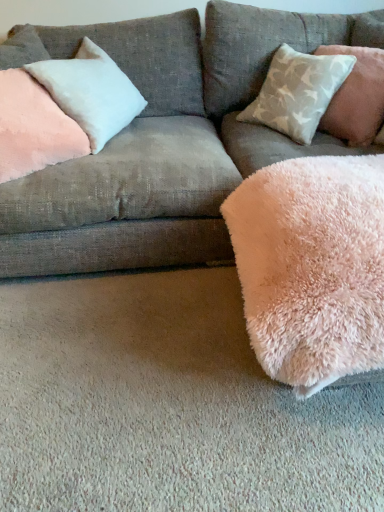
The image size is (384, 512). Describe the element at coordinates (91, 92) in the screenshot. I see `satin white pillow at upper left, arranged as the 2th pillow when viewed from the left` at that location.

The width and height of the screenshot is (384, 512). I want to click on light gray textured pillow at upper right, which appears as the first pillow when viewed from the right, so click(x=356, y=97).

The image size is (384, 512). Describe the element at coordinates (312, 267) in the screenshot. I see `fluffy pink blanket at lower right` at that location.

This screenshot has width=384, height=512. I want to click on satin white pillow at upper left, arranged as the 2th pillow when viewed from the left, so click(x=91, y=92).

Is satin white pillow at upper left, positioned as the 2th pillow in right-to-left order, far away from pink plush pillow at upper left, the 3th pillow when ordered from right to left?

No.

Does satin white pillow at upper left, positioned as the 2th pillow in right-to-left order, turn towards pink plush pillow at upper left, which appears as the first pillow when viewed from the left?

Yes, satin white pillow at upper left, positioned as the 2th pillow in right-to-left order, faces towards pink plush pillow at upper left, which appears as the first pillow when viewed from the left.

Which of these two, satin white pillow at upper left, arranged as the 2th pillow when viewed from the left, or pink plush pillow at upper left, which appears as the first pillow when viewed from the left, is wider?

With larger width is satin white pillow at upper left, arranged as the 2th pillow when viewed from the left.

Which object is closer to the camera, satin white pillow at upper left, arranged as the 2th pillow when viewed from the left, or pink plush pillow at upper left, which appears as the first pillow when viewed from the left?

pink plush pillow at upper left, which appears as the first pillow when viewed from the left.

How much distance is there between fluffy pink blanket at lower right and satin white pillow at upper left, arranged as the 2th pillow when viewed from the left?

fluffy pink blanket at lower right and satin white pillow at upper left, arranged as the 2th pillow when viewed from the left, are 33.02 inches apart from each other.

Is fluffy pink blanket at lower right not close to satin white pillow at upper left, positioned as the 2th pillow in right-to-left order?

No, there isn't a large distance between fluffy pink blanket at lower right and satin white pillow at upper left, positioned as the 2th pillow in right-to-left order.

Considering the sizes of objects fluffy pink blanket at lower right and satin white pillow at upper left, positioned as the 2th pillow in right-to-left order, in the image provided, who is wider, fluffy pink blanket at lower right or satin white pillow at upper left, positioned as the 2th pillow in right-to-left order,?

Wider between the two is fluffy pink blanket at lower right.

Which object is further away from the camera, fluffy pink blanket at lower right or satin white pillow at upper left, positioned as the 2th pillow in right-to-left order?

satin white pillow at upper left, positioned as the 2th pillow in right-to-left order, is further away from the camera.

Could you tell me if fluffy pink blanket at lower right is turned towards pink plush pillow at upper left, which appears as the first pillow when viewed from the left?

No, fluffy pink blanket at lower right does not turn towards pink plush pillow at upper left, which appears as the first pillow when viewed from the left.

Are fluffy pink blanket at lower right and pink plush pillow at upper left, the 3th pillow when ordered from right to left, far apart?

That's not correct — fluffy pink blanket at lower right is a little close to pink plush pillow at upper left, the 3th pillow when ordered from right to left.

Is fluffy pink blanket at lower right bigger than pink plush pillow at upper left, which appears as the first pillow when viewed from the left?

Correct, fluffy pink blanket at lower right is larger in size than pink plush pillow at upper left, which appears as the first pillow when viewed from the left.

I want to click on blanket below the pink plush pillow at upper left, the 3th pillow when ordered from right to left (from the image's perspective), so click(312, 267).

From the picture: Can you confirm if pink plush pillow at upper left, the 3th pillow when ordered from right to left, is positioned to the right of satin white pillow at upper left, arranged as the 2th pillow when viewed from the left?

In fact, pink plush pillow at upper left, the 3th pillow when ordered from right to left, is to the left of satin white pillow at upper left, arranged as the 2th pillow when viewed from the left.

Is pink plush pillow at upper left, which appears as the first pillow when viewed from the left, positioned far away from satin white pillow at upper left, positioned as the 2th pillow in right-to-left order?

pink plush pillow at upper left, which appears as the first pillow when viewed from the left, is near satin white pillow at upper left, positioned as the 2th pillow in right-to-left order, not far away.

Can satin white pillow at upper left, positioned as the 2th pillow in right-to-left order, be found inside pink plush pillow at upper left, the 3th pillow when ordered from right to left?

No.

Consider the image. From their relative heights in the image, would you say satin white pillow at upper left, arranged as the 2th pillow when viewed from the left, is taller or shorter than velvet pink pillow at upper left?

Clearly, satin white pillow at upper left, arranged as the 2th pillow when viewed from the left, is shorter compared to velvet pink pillow at upper left.

What's the angular difference between satin white pillow at upper left, arranged as the 2th pillow when viewed from the left, and velvet pink pillow at upper left's facing directions?

The angle between the facing direction of satin white pillow at upper left, arranged as the 2th pillow when viewed from the left, and the facing direction of velvet pink pillow at upper left is 22.7 degrees.

Is satin white pillow at upper left, arranged as the 2th pillow when viewed from the left, touching velvet pink pillow at upper left?

No, satin white pillow at upper left, arranged as the 2th pillow when viewed from the left, is not with velvet pink pillow at upper left.

Considering the relative positions of satin white pillow at upper left, arranged as the 2th pillow when viewed from the left, and velvet pink pillow at upper left in the image provided, is satin white pillow at upper left, arranged as the 2th pillow when viewed from the left, to the left or to the right of velvet pink pillow at upper left?

Clearly, satin white pillow at upper left, arranged as the 2th pillow when viewed from the left, is on the left of velvet pink pillow at upper left in the image.

Is point (32, 66) farther from camera compared to point (377, 48)?

No.

Is satin white pillow at upper left, positioned as the 2th pillow in right-to-left order, directly adjacent to light gray textured pillow at upper right, which appears as the first pillow when viewed from the right?

No.

Looking at their sizes, would you say satin white pillow at upper left, positioned as the 2th pillow in right-to-left order, is wider or thinner than light gray textured pillow at upper right, which is the 3th pillow from left to right?

Clearly, satin white pillow at upper left, positioned as the 2th pillow in right-to-left order, has less width compared to light gray textured pillow at upper right, which is the 3th pillow from left to right.

Considering the relative positions of satin white pillow at upper left, arranged as the 2th pillow when viewed from the left, and light gray textured pillow at upper right, which appears as the first pillow when viewed from the right, in the image provided, is satin white pillow at upper left, arranged as the 2th pillow when viewed from the left, to the left of light gray textured pillow at upper right, which appears as the first pillow when viewed from the right, from the viewer's perspective?

Yes.

Which is behind, light gray textured pillow at upper right, which appears as the first pillow when viewed from the right, or pink plush pillow at upper left, which appears as the first pillow when viewed from the left?

light gray textured pillow at upper right, which appears as the first pillow when viewed from the right, is behind.

From the image's perspective, which is below, light gray textured pillow at upper right, which is the 3th pillow from left to right, or pink plush pillow at upper left, which appears as the first pillow when viewed from the left?

From the image's view, pink plush pillow at upper left, which appears as the first pillow when viewed from the left, is below.

Is pink plush pillow at upper left, which appears as the first pillow when viewed from the left, a part of light gray textured pillow at upper right, which is the 3th pillow from left to right?

No, pink plush pillow at upper left, which appears as the first pillow when viewed from the left, is located outside of light gray textured pillow at upper right, which is the 3th pillow from left to right.

From the picture: Considering the relative sizes of light gray textured pillow at upper right, which is the 3th pillow from left to right, and pink plush pillow at upper left, the 3th pillow when ordered from right to left, in the image provided, is light gray textured pillow at upper right, which is the 3th pillow from left to right, wider than pink plush pillow at upper left, the 3th pillow when ordered from right to left,?

Yes.

Find the location of `pillow that is below the satin white pillow at upper left, positioned as the 2th pillow in right-to-left order (from the image's perspective)`. pillow that is below the satin white pillow at upper left, positioned as the 2th pillow in right-to-left order (from the image's perspective) is located at coordinates (33, 128).

Find the location of a particular element. The width and height of the screenshot is (384, 512). blanket in front of the satin white pillow at upper left, arranged as the 2th pillow when viewed from the left is located at coordinates (312, 267).

Based on the photo, considering their positions, is light gray textured pillow at upper right, which is the 3th pillow from left to right, positioned closer to fluffy pink blanket at lower right than pink plush pillow at upper left, the 3th pillow when ordered from right to left?

Based on the image, light gray textured pillow at upper right, which is the 3th pillow from left to right, appears to be nearer to fluffy pink blanket at lower right.

Considering their positions, is velvet pink pillow at upper left positioned further to light gray textured pillow at upper right, which is the 3th pillow from left to right, than fluffy pink blanket at lower right?

fluffy pink blanket at lower right is further to light gray textured pillow at upper right, which is the 3th pillow from left to right.

When comparing their distances from satin white pillow at upper left, positioned as the 2th pillow in right-to-left order, does velvet pink pillow at upper left or light gray textured pillow at upper right, which is the 3th pillow from left to right, seem further?

The object further to satin white pillow at upper left, positioned as the 2th pillow in right-to-left order, is light gray textured pillow at upper right, which is the 3th pillow from left to right.

Based on their spatial positions, is pink plush pillow at upper left, which appears as the first pillow when viewed from the left, or light gray textured pillow at upper right, which appears as the first pillow when viewed from the right, closer to satin white pillow at upper left, arranged as the 2th pillow when viewed from the left?

pink plush pillow at upper left, which appears as the first pillow when viewed from the left, is positioned closer to the anchor satin white pillow at upper left, arranged as the 2th pillow when viewed from the left.

Which object lies nearer to the anchor point fluffy pink blanket at lower right, pink plush pillow at upper left, which appears as the first pillow when viewed from the left, or satin white pillow at upper left, positioned as the 2th pillow in right-to-left order?

satin white pillow at upper left, positioned as the 2th pillow in right-to-left order, is positioned closer to the anchor fluffy pink blanket at lower right.

Which object lies nearer to the anchor point fluffy pink blanket at lower right, satin white pillow at upper left, arranged as the 2th pillow when viewed from the left, or light gray textured pillow at upper right, which appears as the first pillow when viewed from the right?

light gray textured pillow at upper right, which appears as the first pillow when viewed from the right, is positioned closer to the anchor fluffy pink blanket at lower right.

Based on their spatial positions, is velvet pink pillow at upper left or pink plush pillow at upper left, which appears as the first pillow when viewed from the left, closer to satin white pillow at upper left, positioned as the 2th pillow in right-to-left order?

The object closer to satin white pillow at upper left, positioned as the 2th pillow in right-to-left order, is pink plush pillow at upper left, which appears as the first pillow when viewed from the left.

From the image, which object appears to be nearer to light gray textured pillow at upper right, which appears as the first pillow when viewed from the right, pink plush pillow at upper left, the 3th pillow when ordered from right to left, or satin white pillow at upper left, arranged as the 2th pillow when viewed from the left?

satin white pillow at upper left, arranged as the 2th pillow when viewed from the left, is positioned closer to the anchor light gray textured pillow at upper right, which appears as the first pillow when viewed from the right.

Image resolution: width=384 pixels, height=512 pixels. Find the location of `studio couch between satin white pillow at upper left, positioned as the 2th pillow in right-to-left order, and light gray textured pillow at upper right, which is the 3th pillow from left to right, in the horizontal direction`. studio couch between satin white pillow at upper left, positioned as the 2th pillow in right-to-left order, and light gray textured pillow at upper right, which is the 3th pillow from left to right, in the horizontal direction is located at coordinates (162, 143).

The height and width of the screenshot is (512, 384). Find the location of `studio couch situated between pink plush pillow at upper left, the 3th pillow when ordered from right to left, and light gray textured pillow at upper right, which appears as the first pillow when viewed from the right, from left to right`. studio couch situated between pink plush pillow at upper left, the 3th pillow when ordered from right to left, and light gray textured pillow at upper right, which appears as the first pillow when viewed from the right, from left to right is located at coordinates (162, 143).

Locate an element on the screen. The image size is (384, 512). blanket located between satin white pillow at upper left, arranged as the 2th pillow when viewed from the left, and light gray textured pillow at upper right, which is the 3th pillow from left to right, in the left-right direction is located at coordinates (312, 267).

Locate an element on the screen. studio couch between satin white pillow at upper left, positioned as the 2th pillow in right-to-left order, and fluffy pink blanket at lower right is located at coordinates (162, 143).